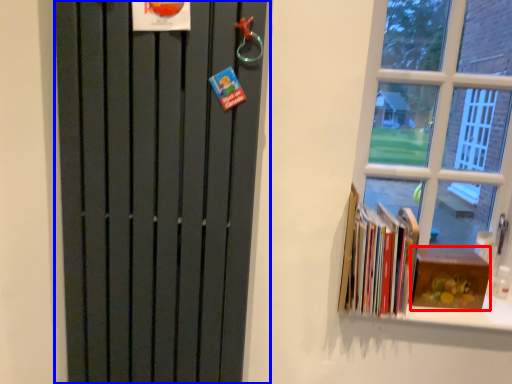
Question: Which of the following is the farthest to the observer, paperback book (highlighted by a red box) or door (highlighted by a blue box)?

Choices:
 (A) paperback book
 (B) door

Answer: (A)